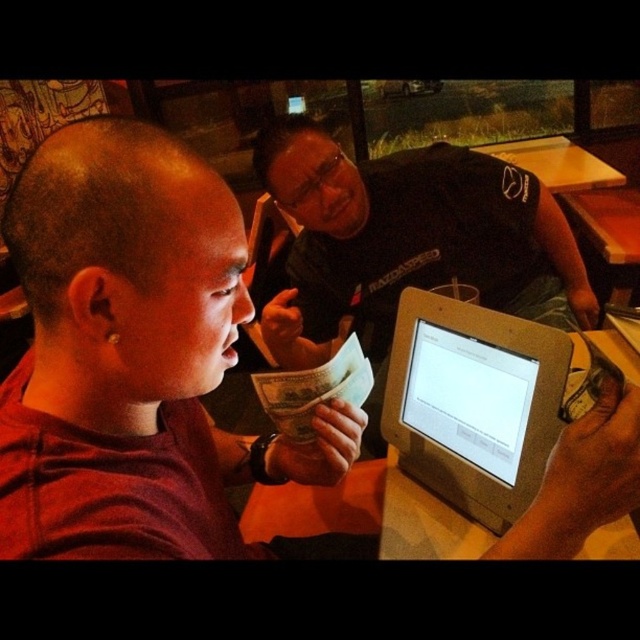
Question: Can you confirm if black matte shirt at center is positioned to the right of silver metallic tablet at center?

Choices:
 (A) no
 (B) yes

Answer: (B)

Question: Which object is positioned farthest from the silver metallic tablet at center?

Choices:
 (A) wooden table at upper center
 (B) silver metallic monitor at center
 (C) black matte shirt at center

Answer: (A)

Question: Observing the image, what is the correct spatial positioning of black matte shirt at center in reference to silver metallic monitor at center?

Choices:
 (A) right
 (B) left

Answer: (A)

Question: Which of the following is the closest to the observer?

Choices:
 (A) (556, 192)
 (B) (472, 396)
 (C) (424, 225)
 (D) (504, 429)

Answer: (D)

Question: Is silver metallic monitor at center positioned in front of wooden table at upper center?

Choices:
 (A) yes
 (B) no

Answer: (A)

Question: Considering the real-world distances, which object is farthest from the silver metallic monitor at center?

Choices:
 (A) silver metallic tablet at center
 (B) wooden table at upper center
 (C) black matte shirt at center

Answer: (B)